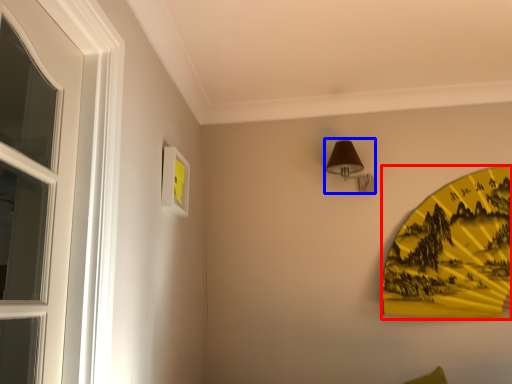
Question: Which of the following is the closest to the observer, design (highlighted by a red box) or lamp (highlighted by a blue box)?

Choices:
 (A) design
 (B) lamp

Answer: (A)